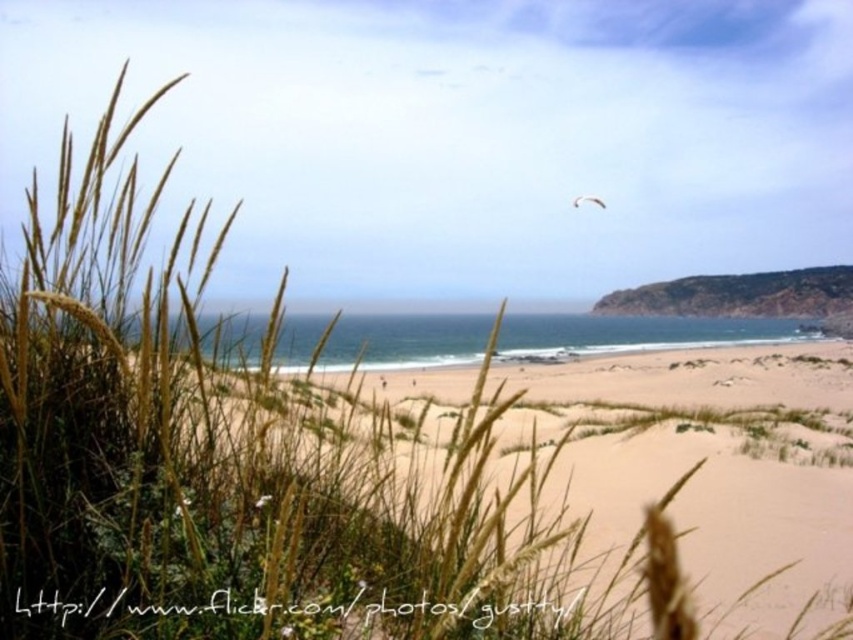
Question: Which object is the farthest from the light brown sandy beach at center?

Choices:
 (A) brown rocky cliff at upper right
 (B) white feathered bird at upper center

Answer: (A)

Question: Is light brown sandy beach at center in front of white feathered bird at upper center?

Choices:
 (A) yes
 (B) no

Answer: (A)

Question: Which object is closer to the camera taking this photo?

Choices:
 (A) white feathered bird at upper center
 (B) brown rocky cliff at upper right

Answer: (A)

Question: Which object is the farthest from the brown rocky cliff at upper right?

Choices:
 (A) light brown sandy beach at center
 (B) white feathered bird at upper center

Answer: (A)

Question: Is the position of light brown sandy beach at center less distant than that of brown rocky cliff at upper right?

Choices:
 (A) no
 (B) yes

Answer: (B)

Question: Can you confirm if light brown sandy beach at center is positioned to the left of brown rocky cliff at upper right?

Choices:
 (A) no
 (B) yes

Answer: (B)